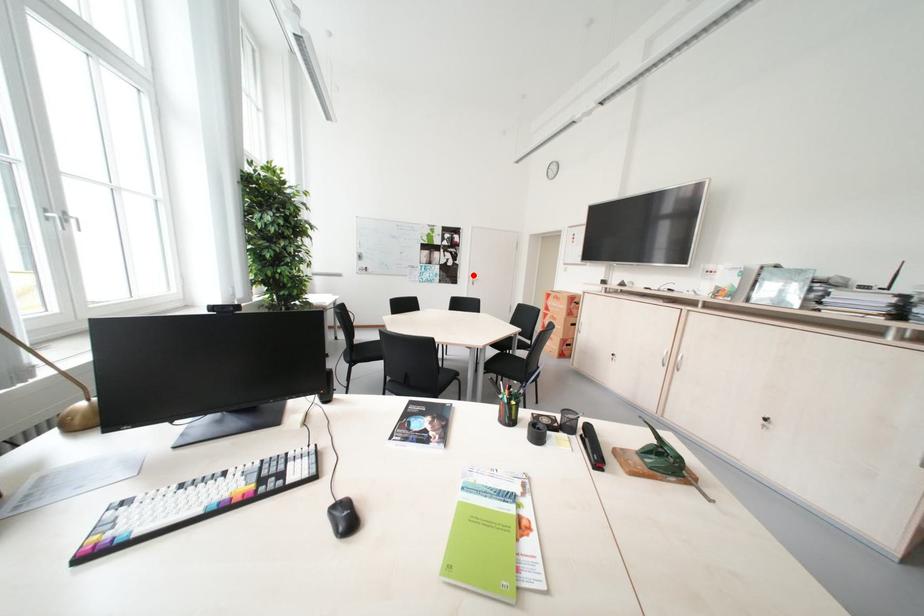
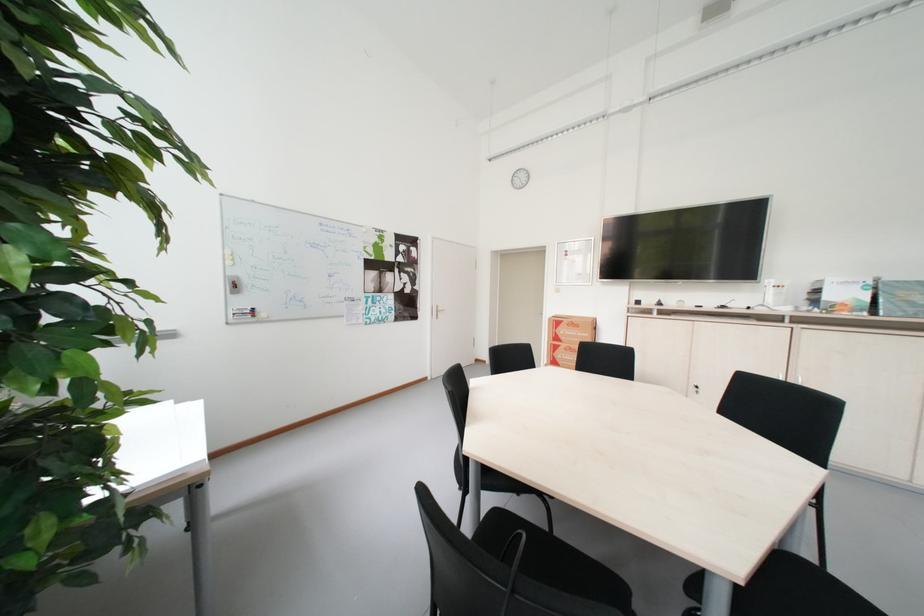
The point at the highlighted location is marked in the first image. Where is the corresponding point in the second image?

(434, 305)